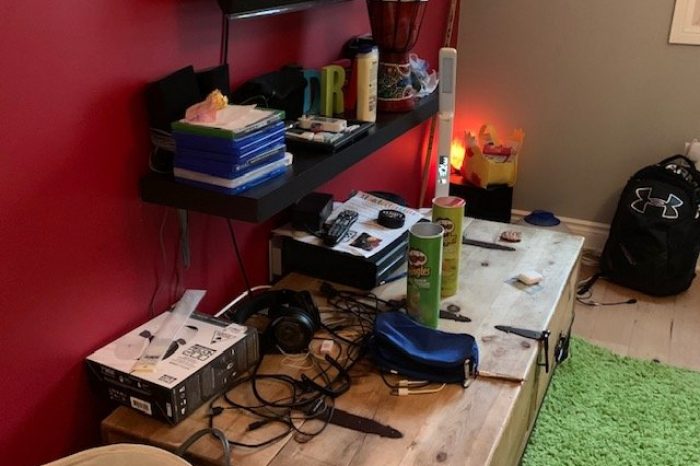
Find the location of a particular element. vertical fan or air conditioner is located at coordinates (444, 100).